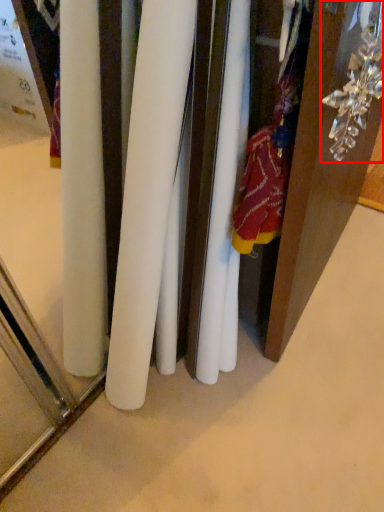
Question: In this image, where is accessory (annotated by the red box) located relative to surface?

Choices:
 (A) right
 (B) left

Answer: (A)